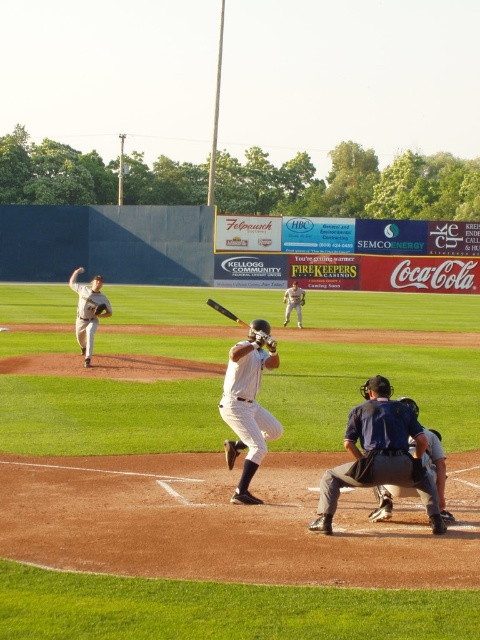
Between point (98, 316) and point (287, 321), which one is positioned in front?

Point (98, 316) is in front.

Looking at this image, does gray uniformed pitcher at left have a greater height compared to white uniform baseball player at center?

Yes, gray uniformed pitcher at left is taller than white uniform baseball player at center.

Who is more forward, (79, 298) or (299, 310)?

Positioned in front is point (79, 298).

Find the location of a particular element. gray uniformed pitcher at left is located at coordinates (87, 310).

Who is more distant from viewer, (238, 321) or (300, 298)?

Point (300, 298)

Is black matte baseball bat at center shorter than brown leather glove at center?

In fact, black matte baseball bat at center may be taller than brown leather glove at center.

Between point (226, 308) and point (300, 304), which one is positioned in front?

Point (226, 308)

Locate an element on the screen. Image resolution: width=480 pixels, height=640 pixels. black matte baseball bat at center is located at coordinates (226, 312).

Measure the distance between point (409, 438) and camera.

The distance of point (409, 438) from camera is 23.25 feet.

Is point (432, 460) positioned before point (300, 301)?

That is True.

Where is `dark blue uniform at lower center`? This screenshot has height=640, width=480. dark blue uniform at lower center is located at coordinates (436, 468).